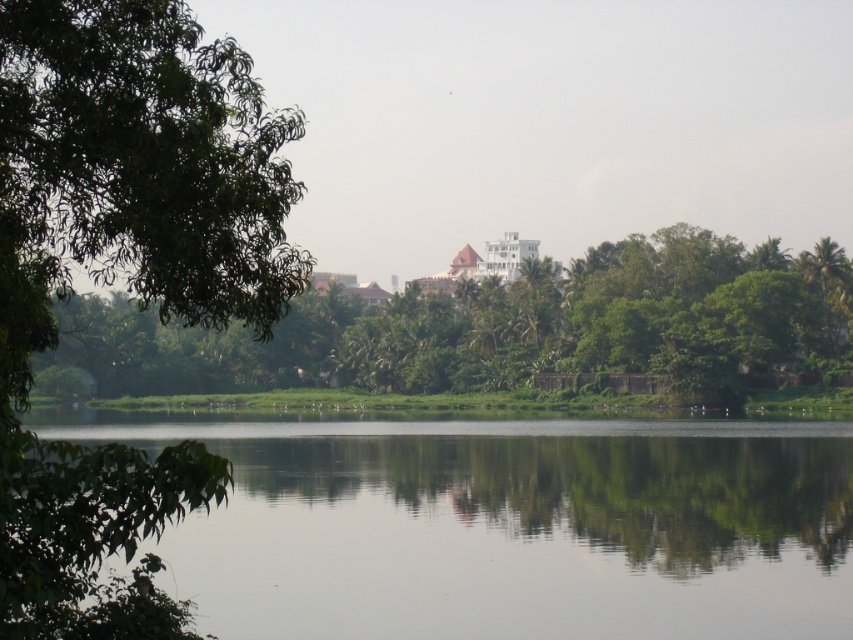
Question: Based on their relative distances, which object is nearer to the white glossy palace at center?

Choices:
 (A) green leafy tree at center
 (B) green leafy tree at left

Answer: (A)

Question: Which of the following is the closest to the observer?

Choices:
 (A) smooth reflective water at center
 (B) white glossy palace at center

Answer: (A)

Question: Does smooth reflective water at center appear under white glossy palace at center?

Choices:
 (A) no
 (B) yes

Answer: (B)

Question: Estimate the real-world distances between objects in this image. Which object is closer to the white glossy palace at center?

Choices:
 (A) green leafy tree at left
 (B) green leafy tree at center
 (C) smooth reflective water at center

Answer: (B)

Question: Is the position of green leafy tree at left more distant than that of green leafy tree at center?

Choices:
 (A) no
 (B) yes

Answer: (A)

Question: Can you confirm if green leafy tree at left is positioned to the left of white glossy palace at center?

Choices:
 (A) no
 (B) yes

Answer: (B)